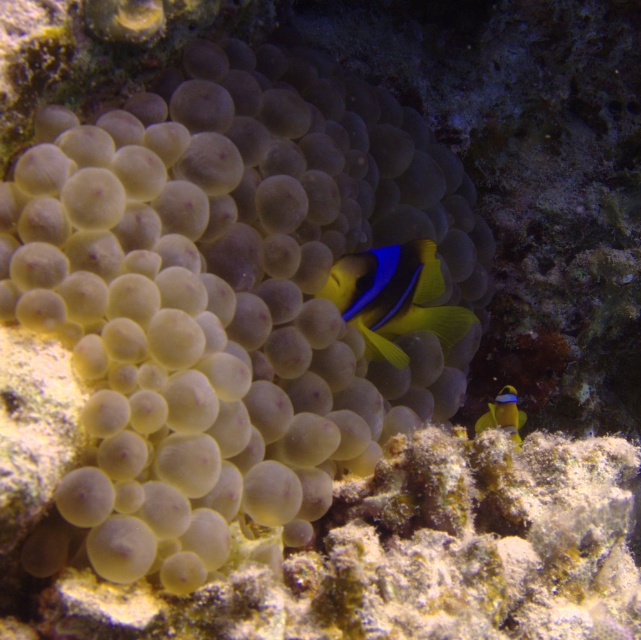
Is point (345, 323) closer to viewer compared to point (519, 420)?

That is True.

Is point (426, 260) more distant than point (476, 426)?

No, (426, 260) is closer to viewer.

The image size is (641, 640). What do you see at coordinates (394, 298) in the screenshot?
I see `yellow matte clownfish at center` at bounding box center [394, 298].

I want to click on yellow matte clownfish at center, so click(394, 298).